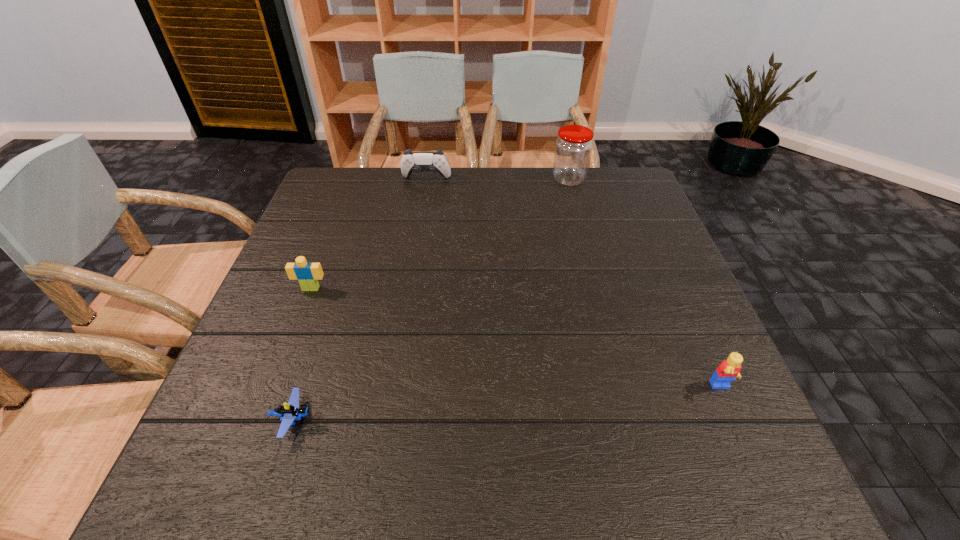
Image resolution: width=960 pixels, height=540 pixels. I want to click on free spot located 0.100m on the front-facing side of the shortest Lego, so click(x=372, y=420).

Where is `jar that is at the far edge`? This screenshot has height=540, width=960. jar that is at the far edge is located at coordinates (573, 148).

I want to click on control that is at the far edge, so click(x=411, y=161).

Locate an element on the screen. Image resolution: width=960 pixels, height=540 pixels. object situated at the near edge is located at coordinates (291, 411).

What are the coordinates of `jar located at the right edge` in the screenshot? It's located at (573, 148).

This screenshot has width=960, height=540. Identify the location of Lego that is at the right edge. (728, 370).

I want to click on object that is at the near left corner, so click(291, 411).

What are the coordinates of `object that is positioned at the far right corner` in the screenshot? It's located at (573, 148).

In the image, there is a desktop. Identify the location of vacant region at the far edge. (537, 212).

In the image, there is a desktop. Find the location of `vacant region at the near edge`. vacant region at the near edge is located at coordinates (428, 480).